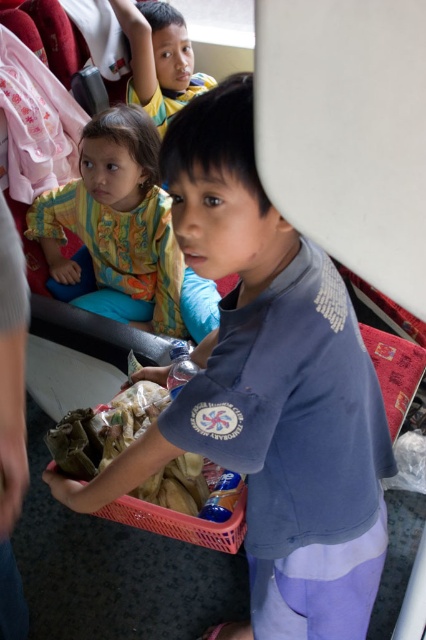
What do you see at coordinates (158, 60) in the screenshot? The width and height of the screenshot is (426, 640). I see `yellow shirt at upper left` at bounding box center [158, 60].

Does yellow shirt at upper left appear on the left side of pink plastic basket at center?

Yes, yellow shirt at upper left is to the left of pink plastic basket at center.

Image resolution: width=426 pixels, height=640 pixels. What do you see at coordinates (158, 60) in the screenshot?
I see `yellow shirt at upper left` at bounding box center [158, 60].

You are a GUI agent. You are given a task and a screenshot of the screen. Output one action in this format:
    pyautogui.click(x=<x>, y=<y>)
    Task: Click on the yellow shirt at upper left
    The image size is (426, 640).
    Given the screenshot: What is the action you would take?
    pyautogui.click(x=158, y=60)

Which of these two, multicolored fabric shirt at upper left or pink plastic basket at center, stands shorter?

pink plastic basket at center is shorter.

Is multicolored fabric shirt at upper left further to the viewer compared to pink plastic basket at center?

That is True.

Where is `multicolored fabric shirt at upper left`? This screenshot has height=640, width=426. multicolored fabric shirt at upper left is located at coordinates (117, 216).

Locate an element on the screen. This screenshot has width=426, height=640. multicolored fabric shirt at upper left is located at coordinates (117, 216).

Who is shorter, blue cotton shirt at center or multicolored fabric shirt at upper left?

With less height is multicolored fabric shirt at upper left.

Can you confirm if blue cotton shirt at center is positioned below multicolored fabric shirt at upper left?

Indeed, blue cotton shirt at center is positioned under multicolored fabric shirt at upper left.

Where is `blue cotton shirt at center`? The width and height of the screenshot is (426, 640). blue cotton shirt at center is located at coordinates (268, 390).